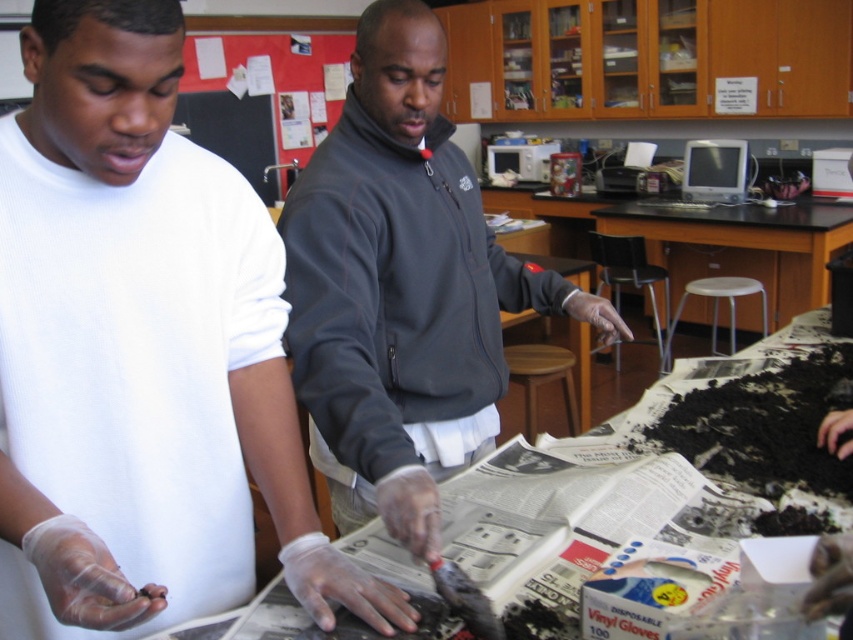
Does transparent plastic gloves at lower center have a smaller size compared to red paperboard at upper left?

Yes.

Does point (76, 0) lie in front of point (260, 180)?

Yes, it is.

The width and height of the screenshot is (853, 640). Describe the element at coordinates (140, 353) in the screenshot. I see `transparent plastic gloves at lower center` at that location.

Where is `transparent plastic gloves at lower center`? The height and width of the screenshot is (640, 853). transparent plastic gloves at lower center is located at coordinates coord(140,353).

Can you confirm if transparent plastic gloves at lower center is bigger than wooden stool at center?

Correct, transparent plastic gloves at lower center is larger in size than wooden stool at center.

Can you confirm if transparent plastic gloves at lower center is positioned above wooden stool at center?

Correct, transparent plastic gloves at lower center is located above wooden stool at center.

Is point (1, 145) behind point (566, 356)?

No, (1, 145) is in front of (566, 356).

At what (x,y) coordinates should I click in order to perform the action: click on transparent plastic gloves at lower center. Please return your answer as a coordinate pair (x, y). Looking at the image, I should click on (140, 353).

Does transparent plastic gloves at lower center appear on the right side of black plastic table at center?

Incorrect, transparent plastic gloves at lower center is not on the right side of black plastic table at center.

Which of these two, transparent plastic gloves at lower center or black plastic table at center, stands shorter?

With less height is transparent plastic gloves at lower center.

What do you see at coordinates (140, 353) in the screenshot? I see `transparent plastic gloves at lower center` at bounding box center [140, 353].

The width and height of the screenshot is (853, 640). In order to click on transparent plastic gloves at lower center in this screenshot , I will do `click(140, 353)`.